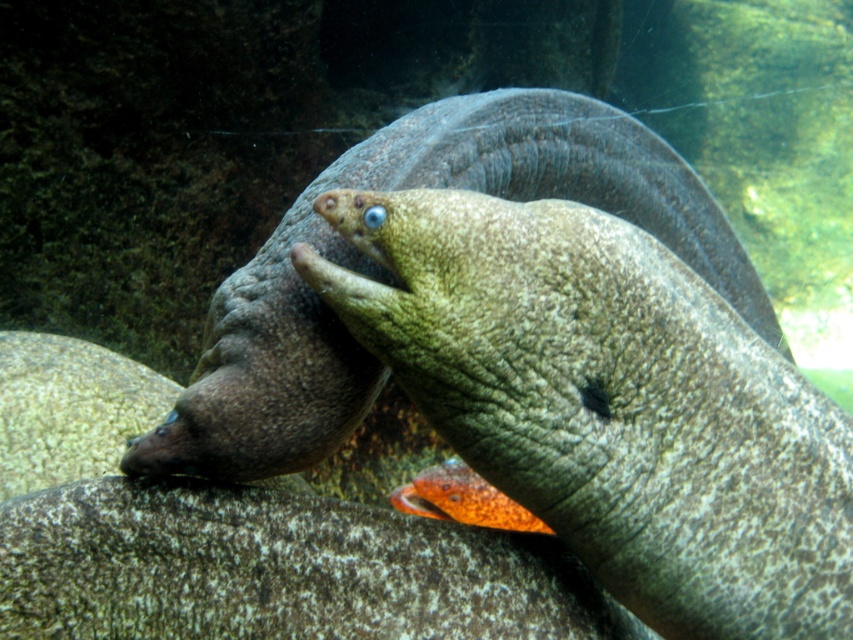
Question: Does smooth orange fish at center appear on the left side of orange glossy fish at center?

Choices:
 (A) yes
 (B) no

Answer: (B)

Question: Among these points, which one is nearest to the camera?

Choices:
 (A) (460, 460)
 (B) (471, 182)
 (C) (668, 486)

Answer: (C)

Question: Which point is closer to the camera taking this photo?

Choices:
 (A) (540, 296)
 (B) (482, 509)

Answer: (A)

Question: Does smooth orange fish at center appear over orange glossy fish at center?

Choices:
 (A) no
 (B) yes

Answer: (B)

Question: Which of the following is the farthest from the observer?

Choices:
 (A) smooth gray moray eel at center
 (B) orange glossy fish at center

Answer: (B)

Question: Is smooth orange fish at center wider than smooth gray moray eel at center?

Choices:
 (A) no
 (B) yes

Answer: (A)